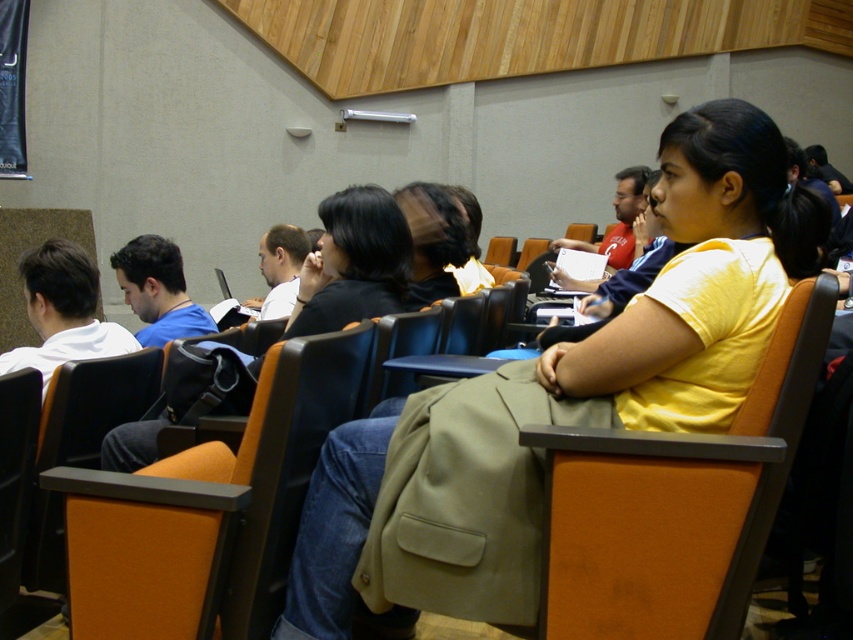
Which is more to the left, orange leather chair at center or orange fabric chair at left?

From the viewer's perspective, orange fabric chair at left appears more on the left side.

Is orange leather chair at center in front of orange fabric chair at left?

That is True.

Is point (822, 332) farther from camera compared to point (213, 621)?

No, (822, 332) is in front of (213, 621).

Locate an element on the screen. orange leather chair at center is located at coordinates (676, 502).

Can you confirm if yellow matte shirt at center is smaller than orange fabric chair at left?

No, yellow matte shirt at center is not smaller than orange fabric chair at left.

Is yellow matte shirt at center further to camera compared to orange fabric chair at left?

No, yellow matte shirt at center is in front of orange fabric chair at left.

Between point (567, 384) and point (152, 561), which one is positioned in front?

Point (567, 384) is more forward.

You are a GUI agent. You are given a task and a screenshot of the screen. Output one action in this format:
    pyautogui.click(x=<x>, y=<y>)
    Task: Click on the yellow matte shirt at center
    
    Given the screenshot: What is the action you would take?
    pyautogui.click(x=561, y=394)

Can you confirm if yellow matte shirt at center is positioned below orange leather chair at center?

Actually, yellow matte shirt at center is above orange leather chair at center.

Is the position of yellow matte shirt at center more distant than that of orange leather chair at center?

Yes.

Who is more forward, (421, 445) or (772, 394)?

Positioned in front is point (772, 394).

Where is `yellow matte shirt at center`? This screenshot has width=853, height=640. yellow matte shirt at center is located at coordinates (561, 394).